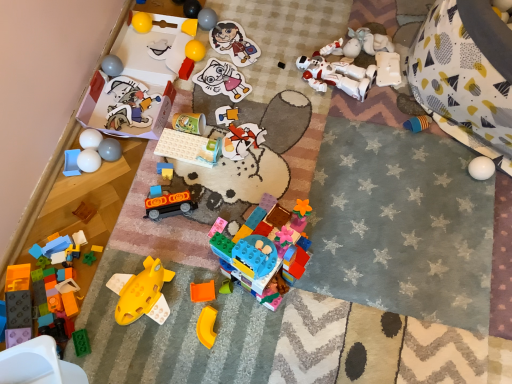
You are a GUI agent. You are given a task and a screenshot of the screen. Output one action in this format:
    pyautogui.click(x=<x>, y=<y>)
    Task: Click on the unoccupied space behind matte paper sticker at center, which appears as the 6th toy when viewed from the right
    
    Given the screenshot: What is the action you would take?
    pyautogui.click(x=230, y=46)